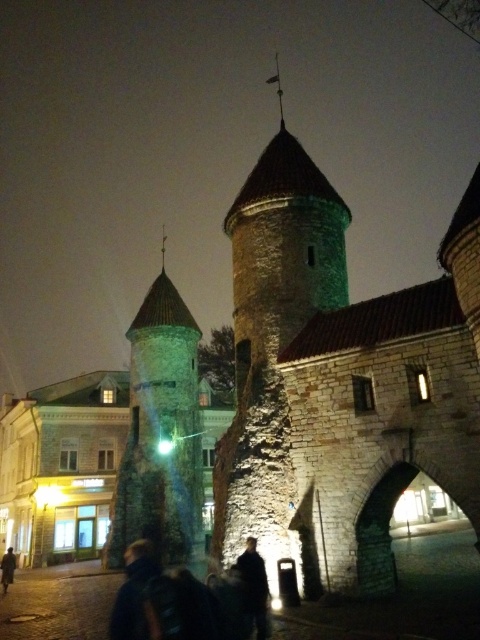
You are standing in front of the historic stone structure and notice two points marked on the image. The first point is at coordinates point (297,276) and the second is at point (1,568). Which of these points is nearer to you?

Point (297,276) is closer to the viewer than point (1,568).

You are standing at the center of the scene and want to place a new decorative light at the exact location where the dark blue jacket at lower left is currently positioned. What are the coordinates of that location?

The coordinates of the dark blue jacket at lower left are at point (133, 592).